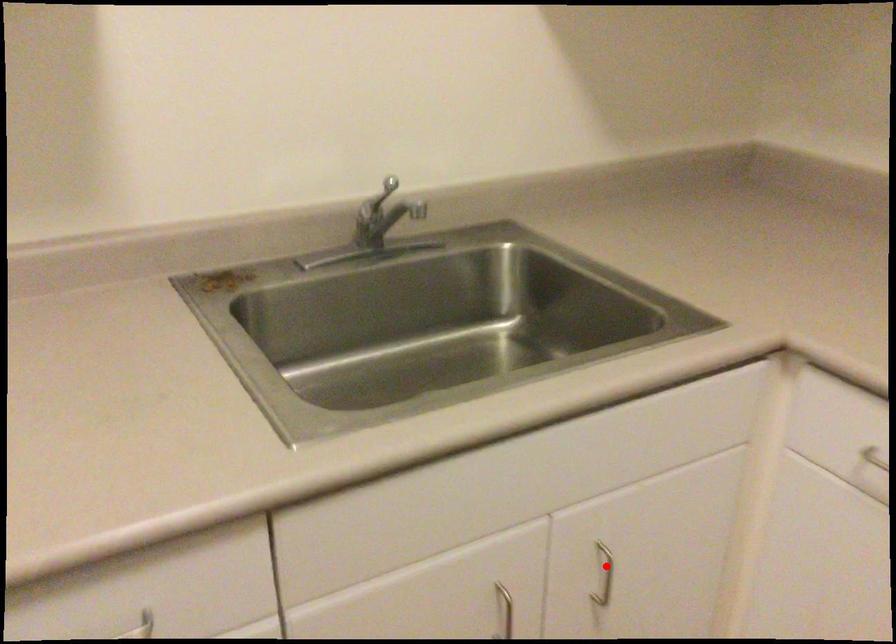
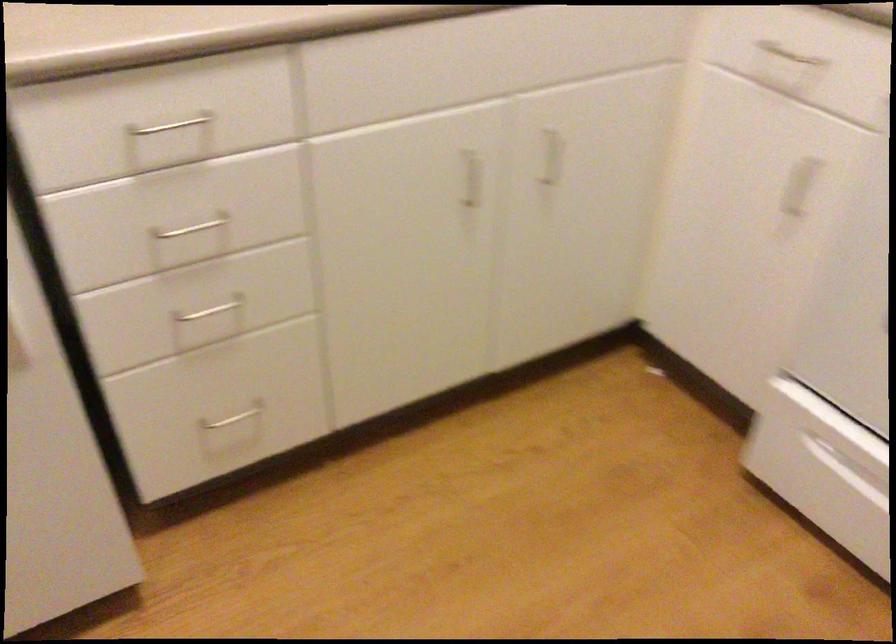
Question: A red point is marked in image1. In image2, is the corresponding 3D point closer to the camera or farther? Reply with the corresponding letter.

Choices:
 (A) The corresponding 3D point is closer.
 (B) The corresponding 3D point is farther.

Answer: (B)